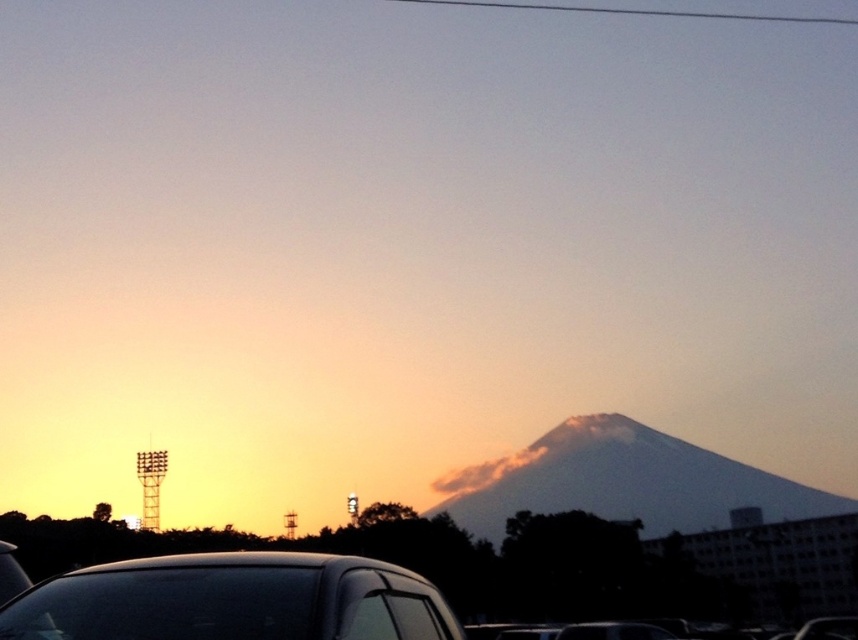
Question: Based on their relative distances, which object is nearer to the shiny black car at lower left?

Choices:
 (A) smokey white cloud at center
 (B) smooth wire at upper center
 (C) smokey gray mountain at center

Answer: (C)

Question: Does shiny black car at lower left have a larger size compared to smokey white cloud at center?

Choices:
 (A) no
 (B) yes

Answer: (A)

Question: Which object is farther from the camera taking this photo?

Choices:
 (A) shiny black car at lower left
 (B) smooth wire at upper center
 (C) smokey white cloud at center

Answer: (B)

Question: Can you confirm if smokey gray mountain at center is positioned below smooth wire at upper center?

Choices:
 (A) yes
 (B) no

Answer: (A)

Question: Which point appears closest to the camera in this image?

Choices:
 (A) (581, 10)
 (B) (125, 576)
 (C) (819, 500)
 (D) (566, 454)

Answer: (B)

Question: Does shiny black car at lower left have a greater width compared to smokey white cloud at center?

Choices:
 (A) no
 (B) yes

Answer: (A)